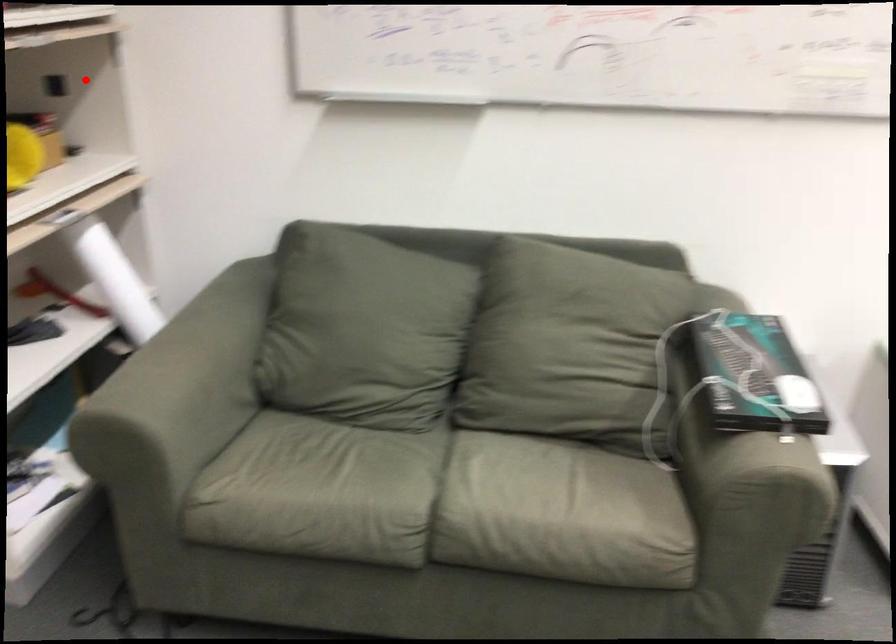
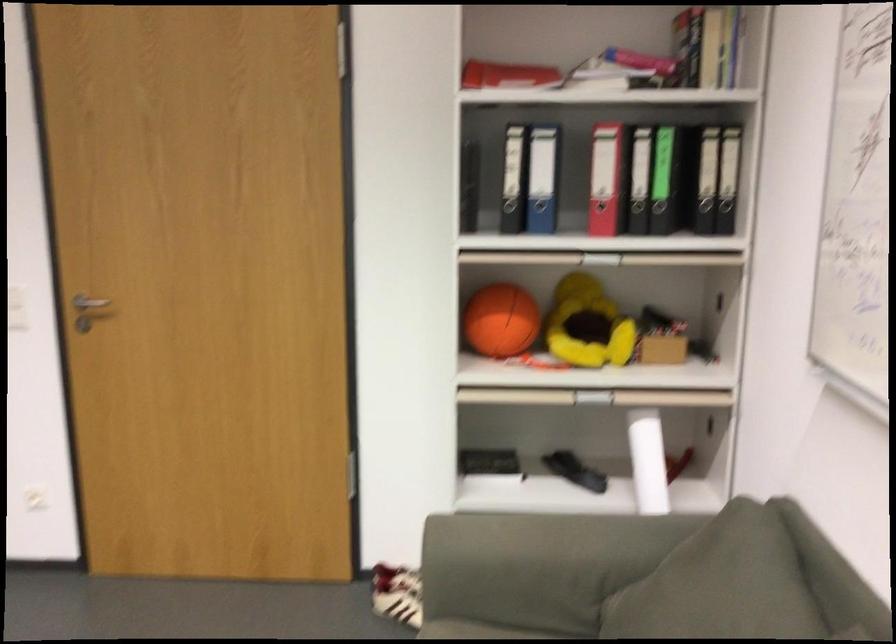
The point at the highlighted location is marked in the first image. Where is the corresponding point in the second image?

(725, 283)